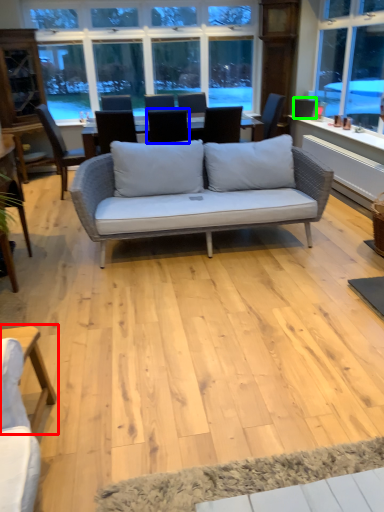
Question: Which object is the closest to the table (highlighted by a red box)? Choose among these: chair (highlighted by a blue box) or armchair (highlighted by a green box).

Choices:
 (A) chair
 (B) armchair

Answer: (A)